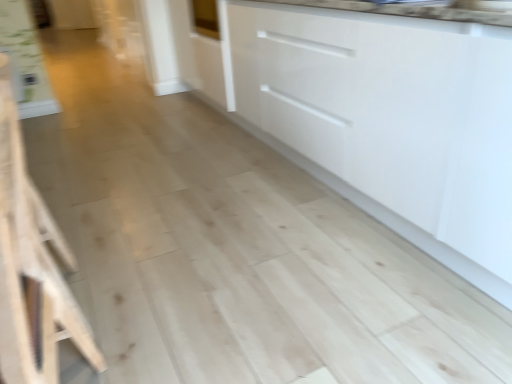
Locate an element on the screen. The width and height of the screenshot is (512, 384). free spot to the right of light wood stool at left is located at coordinates (149, 307).